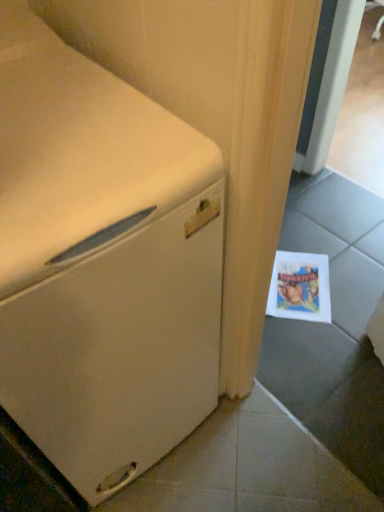
Question: Are white matte refrigerator at left and matte paper postcard at lower right making contact?

Choices:
 (A) no
 (B) yes

Answer: (A)

Question: Is white matte refrigerator at left oriented towards matte paper postcard at lower right?

Choices:
 (A) no
 (B) yes

Answer: (A)

Question: From a real-world perspective, is white matte refrigerator at left beneath matte paper postcard at lower right?

Choices:
 (A) no
 (B) yes

Answer: (A)

Question: Are white matte refrigerator at left and matte paper postcard at lower right located far from each other?

Choices:
 (A) yes
 (B) no

Answer: (B)

Question: Does white matte refrigerator at left have a lesser width compared to matte paper postcard at lower right?

Choices:
 (A) yes
 (B) no

Answer: (B)

Question: From the image's perspective, is white matte refrigerator at left above matte paper postcard at lower right?

Choices:
 (A) yes
 (B) no

Answer: (A)

Question: Considering the relative sizes of matte paper postcard at lower right and white matte refrigerator at left in the image provided, is matte paper postcard at lower right thinner than white matte refrigerator at left?

Choices:
 (A) no
 (B) yes

Answer: (B)

Question: Would you consider matte paper postcard at lower right to be distant from white matte refrigerator at left?

Choices:
 (A) no
 (B) yes

Answer: (A)

Question: Is matte paper postcard at lower right to the right of white matte refrigerator at left from the viewer's perspective?

Choices:
 (A) no
 (B) yes

Answer: (B)

Question: Is matte paper postcard at lower right facing towards white matte refrigerator at left?

Choices:
 (A) yes
 (B) no

Answer: (B)

Question: Considering the relative positions of matte paper postcard at lower right and white matte refrigerator at left in the image provided, is matte paper postcard at lower right to the left of white matte refrigerator at left from the viewer's perspective?

Choices:
 (A) no
 (B) yes

Answer: (A)

Question: From the image's perspective, is matte paper postcard at lower right above white matte refrigerator at left?

Choices:
 (A) no
 (B) yes

Answer: (A)

Question: From the image's perspective, is white matte refrigerator at left above or below matte paper postcard at lower right?

Choices:
 (A) above
 (B) below

Answer: (A)